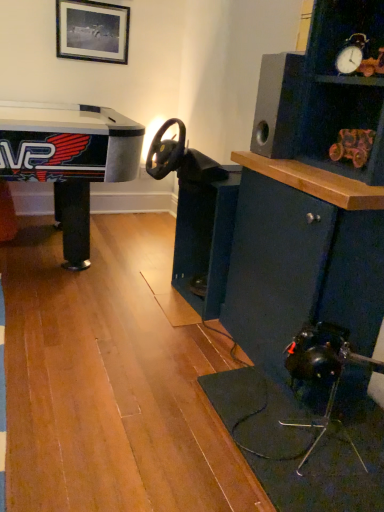
Question: Is wooden toy car at upper right completely or partially inside black matte picture frame at upper center?

Choices:
 (A) yes
 (B) no

Answer: (B)

Question: Can you confirm if black matte picture frame at upper center is shorter than wooden toy car at upper right?

Choices:
 (A) no
 (B) yes

Answer: (A)

Question: From the image's perspective, is black matte picture frame at upper center under wooden toy car at upper right?

Choices:
 (A) yes
 (B) no

Answer: (B)

Question: From a real-world perspective, is black matte picture frame at upper center physically below wooden toy car at upper right?

Choices:
 (A) no
 (B) yes

Answer: (A)

Question: Does black matte picture frame at upper center have a smaller size compared to wooden toy car at upper right?

Choices:
 (A) no
 (B) yes

Answer: (A)

Question: Is black matte picture frame at upper center next to wooden toy car at upper right and touching it?

Choices:
 (A) yes
 (B) no

Answer: (B)

Question: From a real-world perspective, does dark blue wood cabinet at center stand above black matte speaker at upper right?

Choices:
 (A) no
 (B) yes

Answer: (A)

Question: Is dark blue wood cabinet at center shorter than black matte speaker at upper right?

Choices:
 (A) no
 (B) yes

Answer: (A)

Question: Does dark blue wood cabinet at center have a greater height compared to black matte speaker at upper right?

Choices:
 (A) yes
 (B) no

Answer: (A)

Question: Can you confirm if dark blue wood cabinet at center is thinner than black matte speaker at upper right?

Choices:
 (A) no
 (B) yes

Answer: (A)

Question: From the image's perspective, is dark blue wood cabinet at center on black matte speaker at upper right?

Choices:
 (A) no
 (B) yes

Answer: (A)

Question: Does dark blue wood cabinet at center appear on the right side of black matte speaker at upper right?

Choices:
 (A) no
 (B) yes

Answer: (A)

Question: From the image's perspective, is black matte speaker at upper right under wooden toy car at upper right?

Choices:
 (A) no
 (B) yes

Answer: (A)